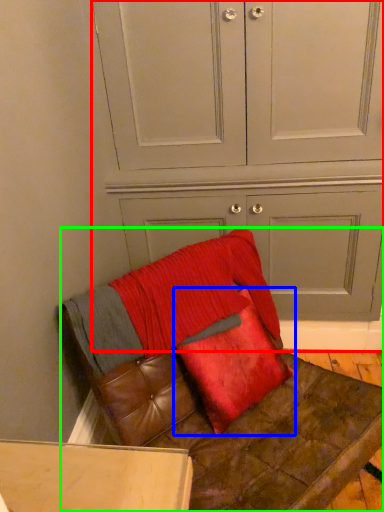
Question: Estimate the real-world distances between objects in this image. Which object is farther from dresser (highlighted by a red box), pillow (highlighted by a blue box) or furniture (highlighted by a green box)?

Choices:
 (A) pillow
 (B) furniture

Answer: (B)